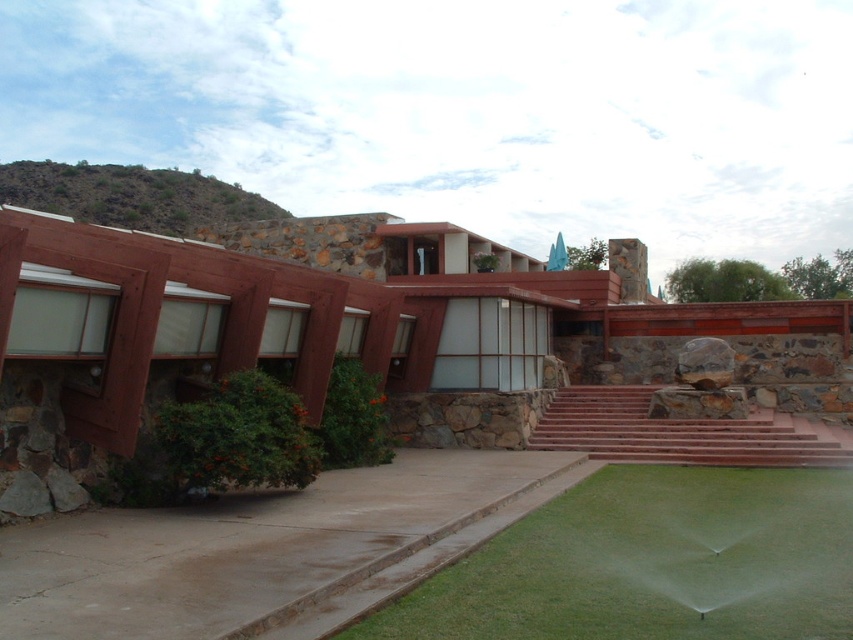
Does brown wood pergola at center lie behind green grass at lower center?

Yes, brown wood pergola at center is further from the viewer.

Which is below, brown wood pergola at center or green grass at lower center?

Positioned lower is green grass at lower center.

Who is more distant from viewer, (396,388) or (636,483)?

The point (396,388) is more distant.

Identify the location of brown wood pergola at center. (404, 346).